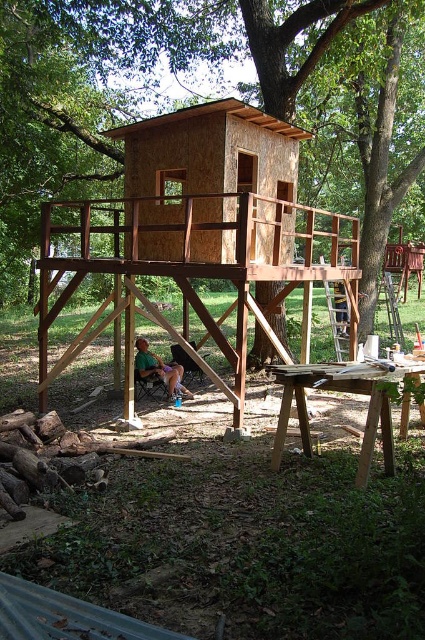
Question: Considering the real-world distances, which object is closest to the wooden treehouse at center?

Choices:
 (A) wooden cabin at center
 (B) green fabric shirt at lower center

Answer: (B)

Question: Does wooden treehouse at center have a smaller size compared to green fabric shirt at lower center?

Choices:
 (A) yes
 (B) no

Answer: (B)

Question: Can you confirm if wooden treehouse at center is bigger than green fabric shirt at lower center?

Choices:
 (A) yes
 (B) no

Answer: (A)

Question: Does wooden cabin at center have a larger size compared to green fabric shirt at lower center?

Choices:
 (A) yes
 (B) no

Answer: (B)

Question: Which object appears farthest from the camera in this image?

Choices:
 (A) wooden treehouse at center
 (B) green fabric shirt at lower center
 (C) wooden cabin at center

Answer: (B)

Question: Considering the real-world distances, which object is farthest from the wooden cabin at center?

Choices:
 (A) green fabric shirt at lower center
 (B) wooden treehouse at center

Answer: (B)